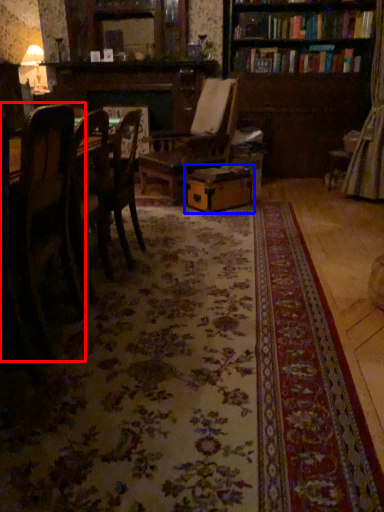
Question: Which of the following is the farthest to the observer, chair (highlighted by a red box) or cardboard box (highlighted by a blue box)?

Choices:
 (A) chair
 (B) cardboard box

Answer: (B)